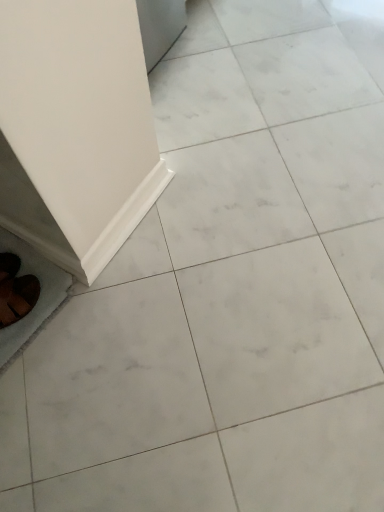
The height and width of the screenshot is (512, 384). Describe the element at coordinates (135, 256) in the screenshot. I see `white glossy baseboard at lower left, which appears as the 1th ceramic tile when viewed from the right` at that location.

The image size is (384, 512). Find the location of `white glossy baseboard at lower left, which appears as the 1th ceramic tile when viewed from the right`. white glossy baseboard at lower left, which appears as the 1th ceramic tile when viewed from the right is located at coordinates tap(135, 256).

Is brown suede shoes at lower left aimed at white glossy ceramic tile at lower left, which appears as the 2th ceramic tile when viewed from the right?

No, brown suede shoes at lower left is not aimed at white glossy ceramic tile at lower left, which appears as the 2th ceramic tile when viewed from the right.

Find the location of a particular element. The image size is (384, 512). the 2nd ceramic tile below the brown suede shoes at lower left (from a real-world perspective) is located at coordinates (38, 298).

Does brown suede shoes at lower left have a greater width compared to white glossy ceramic tile at lower left, which appears as the 2th ceramic tile when viewed from the right?

No.

Considering the relative positions of brown suede shoes at lower left and white glossy ceramic tile at lower left, the first ceramic tile viewed from the left, in the image provided, is brown suede shoes at lower left to the left or to the right of white glossy ceramic tile at lower left, the first ceramic tile viewed from the left,?

Clearly, brown suede shoes at lower left is on the left of white glossy ceramic tile at lower left, the first ceramic tile viewed from the left, in the image.

Would you say brown suede shoes at lower left is outside white glossy baseboard at lower left, the second ceramic tile from the left?

brown suede shoes at lower left lies outside white glossy baseboard at lower left, the second ceramic tile from the left,'s area.

In the scene shown: Between brown suede shoes at lower left and white glossy baseboard at lower left, the second ceramic tile from the left, which one is positioned behind?

white glossy baseboard at lower left, the second ceramic tile from the left, is further away from the camera.

This screenshot has width=384, height=512. Identify the location of footwear above the white glossy baseboard at lower left, the second ceramic tile from the left (from a real-world perspective). (17, 297).

How different are the orientations of brown suede shoes at lower left and white glossy baseboard at lower left, which appears as the 1th ceramic tile when viewed from the right, in degrees?

brown suede shoes at lower left and white glossy baseboard at lower left, which appears as the 1th ceramic tile when viewed from the right, are facing 116 degrees away from each other.

Between white glossy baseboard at lower left, which appears as the 1th ceramic tile when viewed from the right, and white glossy ceramic tile at lower left, the first ceramic tile viewed from the left, which one appears on the left side from the viewer's perspective?

white glossy ceramic tile at lower left, the first ceramic tile viewed from the left.

Is point (146, 265) positioned after point (46, 290)?

Yes, point (146, 265) is behind point (46, 290).

Which object is wider, white glossy baseboard at lower left, which appears as the 1th ceramic tile when viewed from the right, or white glossy ceramic tile at lower left, the first ceramic tile viewed from the left?

With larger width is white glossy ceramic tile at lower left, the first ceramic tile viewed from the left.

Considering the relative sizes of white glossy baseboard at lower left, the second ceramic tile from the left, and brown suede shoes at lower left in the image provided, is white glossy baseboard at lower left, the second ceramic tile from the left, bigger than brown suede shoes at lower left?

No.

From a real-world perspective, who is located lower, white glossy baseboard at lower left, the second ceramic tile from the left, or brown suede shoes at lower left?

white glossy baseboard at lower left, the second ceramic tile from the left, is physically lower.

Would you say white glossy baseboard at lower left, the second ceramic tile from the left, is outside brown suede shoes at lower left?

Yes.

Is white glossy ceramic tile at lower left, the first ceramic tile viewed from the left, positioned before brown suede shoes at lower left?

No, the depth of white glossy ceramic tile at lower left, the first ceramic tile viewed from the left, is greater than that of brown suede shoes at lower left.

Considering the sizes of objects white glossy ceramic tile at lower left, which appears as the 2th ceramic tile when viewed from the right, and brown suede shoes at lower left in the image provided, who is shorter, white glossy ceramic tile at lower left, which appears as the 2th ceramic tile when viewed from the right, or brown suede shoes at lower left?

white glossy ceramic tile at lower left, which appears as the 2th ceramic tile when viewed from the right, is shorter.

Is white glossy ceramic tile at lower left, the first ceramic tile viewed from the left, in contact with brown suede shoes at lower left?

Yes, white glossy ceramic tile at lower left, the first ceramic tile viewed from the left, and brown suede shoes at lower left clearly make contact.

In the scene shown: Can you confirm if white glossy ceramic tile at lower left, which appears as the 2th ceramic tile when viewed from the right, is thinner than brown suede shoes at lower left?

Incorrect, the width of white glossy ceramic tile at lower left, which appears as the 2th ceramic tile when viewed from the right, is not less than that of brown suede shoes at lower left.

Is white glossy ceramic tile at lower left, which appears as the 2th ceramic tile when viewed from the right, directly adjacent to white glossy baseboard at lower left, the second ceramic tile from the left?

white glossy ceramic tile at lower left, which appears as the 2th ceramic tile when viewed from the right, and white glossy baseboard at lower left, the second ceramic tile from the left, are clearly separated.

Is white glossy ceramic tile at lower left, the first ceramic tile viewed from the left, completely or partially outside of white glossy baseboard at lower left, the second ceramic tile from the left?

Yes, white glossy ceramic tile at lower left, the first ceramic tile viewed from the left, is outside of white glossy baseboard at lower left, the second ceramic tile from the left.

Considering the relative sizes of white glossy ceramic tile at lower left, which appears as the 2th ceramic tile when viewed from the right, and white glossy baseboard at lower left, the second ceramic tile from the left, in the image provided, is white glossy ceramic tile at lower left, which appears as the 2th ceramic tile when viewed from the right, shorter than white glossy baseboard at lower left, the second ceramic tile from the left,?

Correct, white glossy ceramic tile at lower left, which appears as the 2th ceramic tile when viewed from the right, is not as tall as white glossy baseboard at lower left, the second ceramic tile from the left.

Where is `footwear located on the left of white glossy ceramic tile at lower left, which appears as the 2th ceramic tile when viewed from the right`? The height and width of the screenshot is (512, 384). footwear located on the left of white glossy ceramic tile at lower left, which appears as the 2th ceramic tile when viewed from the right is located at coordinates (17, 297).

Find the location of a particular element. footwear positioned vertically above the white glossy baseboard at lower left, the second ceramic tile from the left (from a real-world perspective) is located at coordinates (17, 297).

Considering their positions, is white glossy ceramic tile at lower left, which appears as the 2th ceramic tile when viewed from the right, positioned closer to brown suede shoes at lower left than white glossy baseboard at lower left, which appears as the 1th ceramic tile when viewed from the right?

white glossy ceramic tile at lower left, which appears as the 2th ceramic tile when viewed from the right, is positioned closer to the anchor brown suede shoes at lower left.

Based on the photo, which object lies nearer to the anchor point brown suede shoes at lower left, white glossy baseboard at lower left, the second ceramic tile from the left, or white glossy ceramic tile at lower left, which appears as the 2th ceramic tile when viewed from the right?

white glossy ceramic tile at lower left, which appears as the 2th ceramic tile when viewed from the right, is positioned closer to the anchor brown suede shoes at lower left.

Looking at the image, which one is located further to white glossy ceramic tile at lower left, the first ceramic tile viewed from the left, brown suede shoes at lower left or white glossy baseboard at lower left, which appears as the 1th ceramic tile when viewed from the right?

white glossy baseboard at lower left, which appears as the 1th ceramic tile when viewed from the right, lies further to white glossy ceramic tile at lower left, the first ceramic tile viewed from the left, than the other object.

Which object lies further to the anchor point white glossy baseboard at lower left, which appears as the 1th ceramic tile when viewed from the right, white glossy ceramic tile at lower left, the first ceramic tile viewed from the left, or brown suede shoes at lower left?

Based on the image, brown suede shoes at lower left appears to be further to white glossy baseboard at lower left, which appears as the 1th ceramic tile when viewed from the right.

Looking at the image, which one is located further to white glossy baseboard at lower left, the second ceramic tile from the left, brown suede shoes at lower left or white glossy ceramic tile at lower left, which appears as the 2th ceramic tile when viewed from the right?

brown suede shoes at lower left is further to white glossy baseboard at lower left, the second ceramic tile from the left.

From the image, which object appears to be farther from white glossy ceramic tile at lower left, which appears as the 2th ceramic tile when viewed from the right, white glossy baseboard at lower left, which appears as the 1th ceramic tile when viewed from the right, or brown suede shoes at lower left?

white glossy baseboard at lower left, which appears as the 1th ceramic tile when viewed from the right, lies further to white glossy ceramic tile at lower left, which appears as the 2th ceramic tile when viewed from the right, than the other object.

Where is `ceramic tile located between brown suede shoes at lower left and white glossy baseboard at lower left, the second ceramic tile from the left, in the left-right direction`? ceramic tile located between brown suede shoes at lower left and white glossy baseboard at lower left, the second ceramic tile from the left, in the left-right direction is located at coordinates (38, 298).